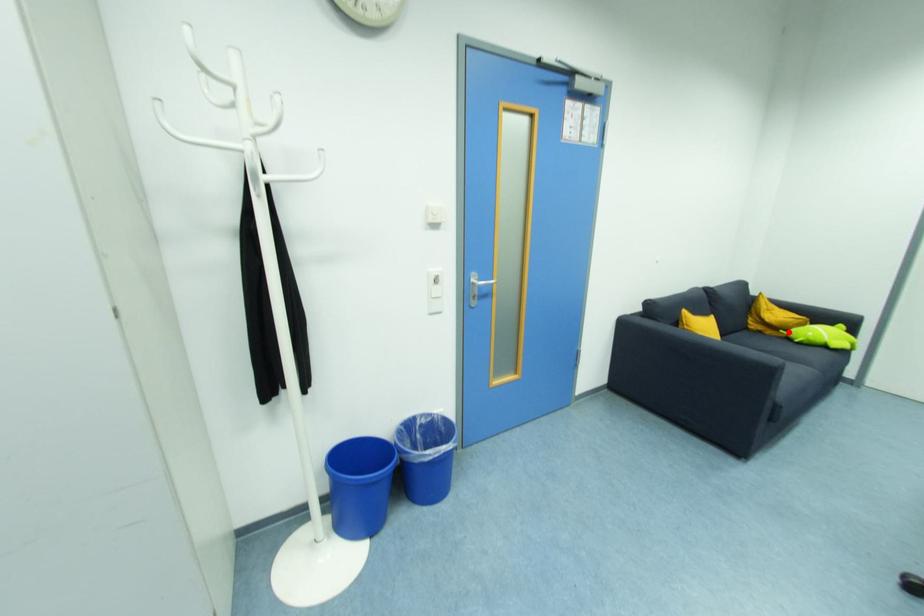
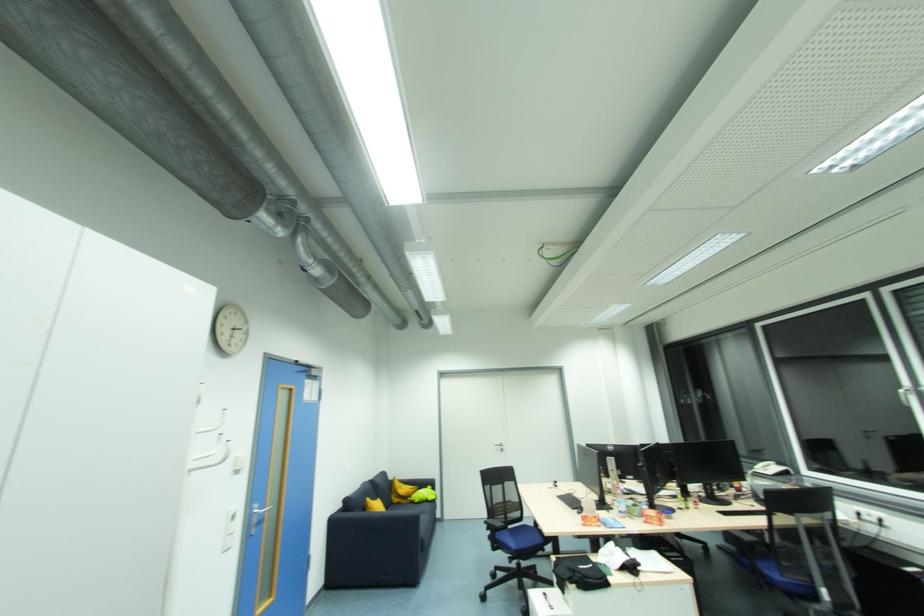
Question: I am providing you with two images of the same scene from different viewpoints. A red point is marked on the first image. Is the red point's position out of view in image 2?

Choices:
 (A) Yes
 (B) No

Answer: (B)